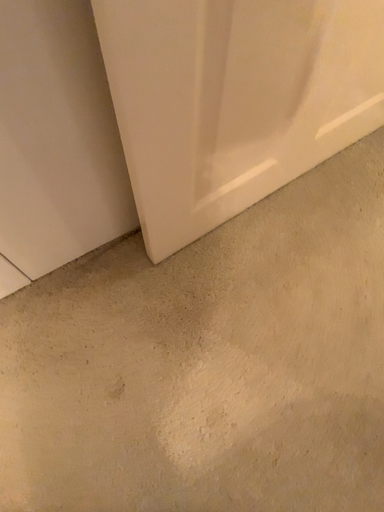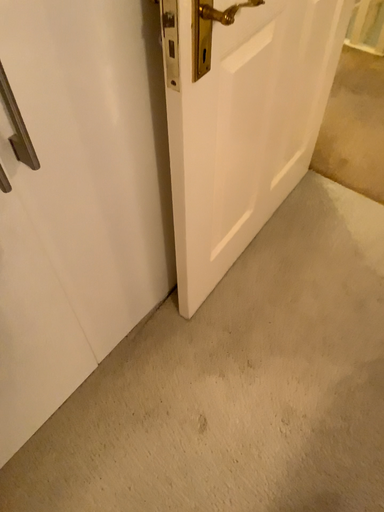
Question: How did the camera likely rotate when shooting the video?

Choices:
 (A) rotated upward
 (B) rotated downward

Answer: (A)